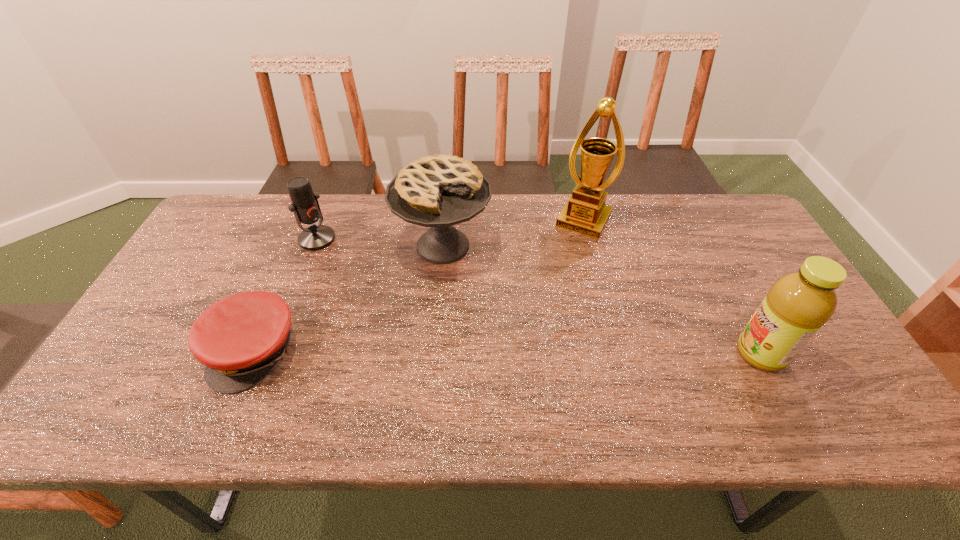
Locate an element on the screen. This screenshot has width=960, height=540. vacant space on the desktop that is between the cap and the rightmost object and is positioned on the front-facing side of the tallest object is located at coordinates (511, 353).

Locate an element on the screen. vacant spot on the desktop that is between the cap and the fruit juice and is positioned on the cut side of the third object from left to right is located at coordinates (472, 352).

Identify the location of free spot on the desktop that is between the shortest object and the fruit juice and is positioned on the side of the second shortest object with the red ring. (466, 352).